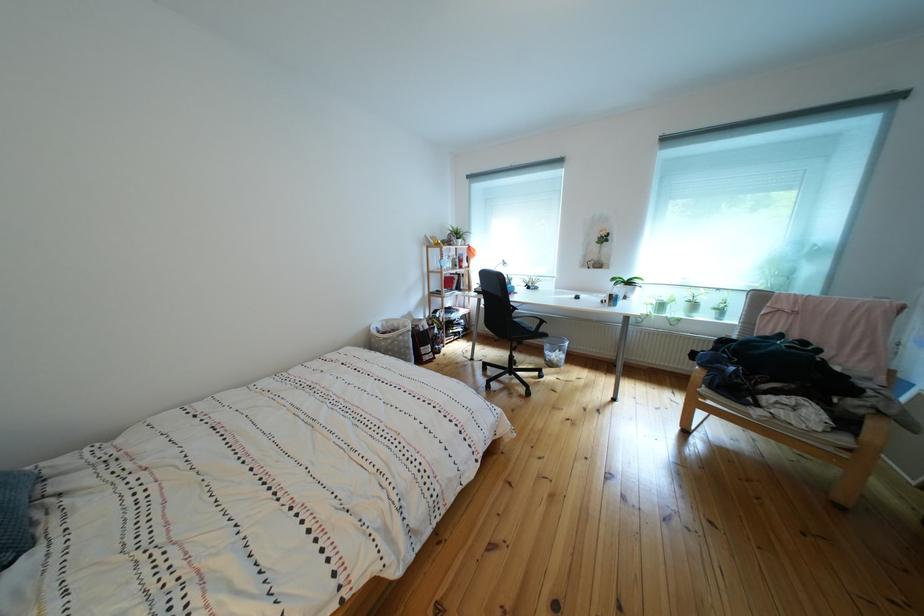
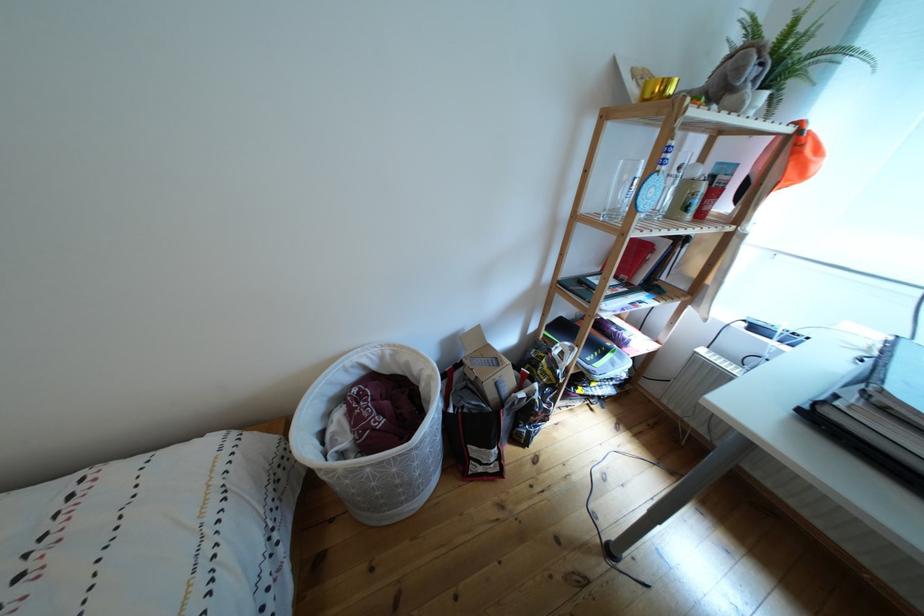
The point at (x=465, y=244) is marked in the first image. Where is the corresponding point in the second image?

(762, 77)